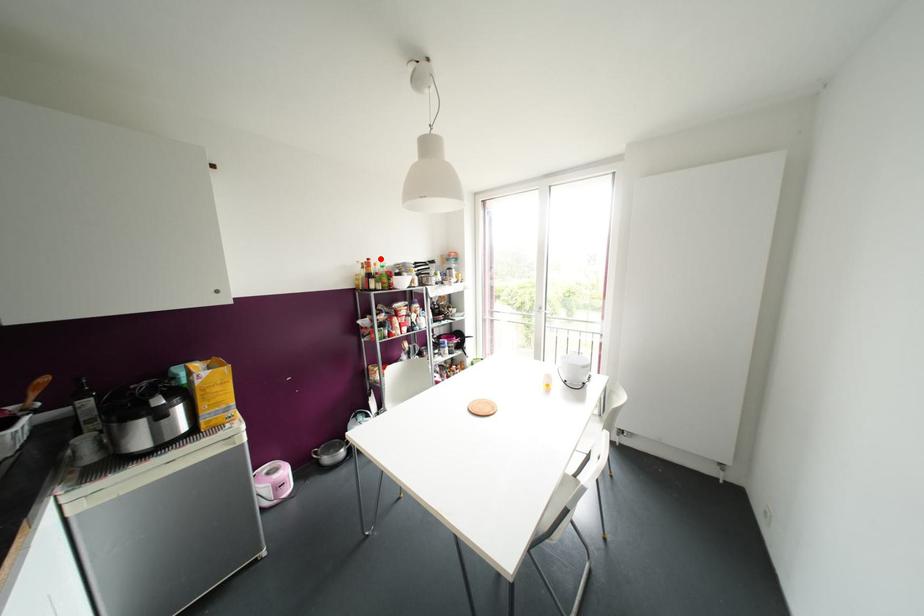
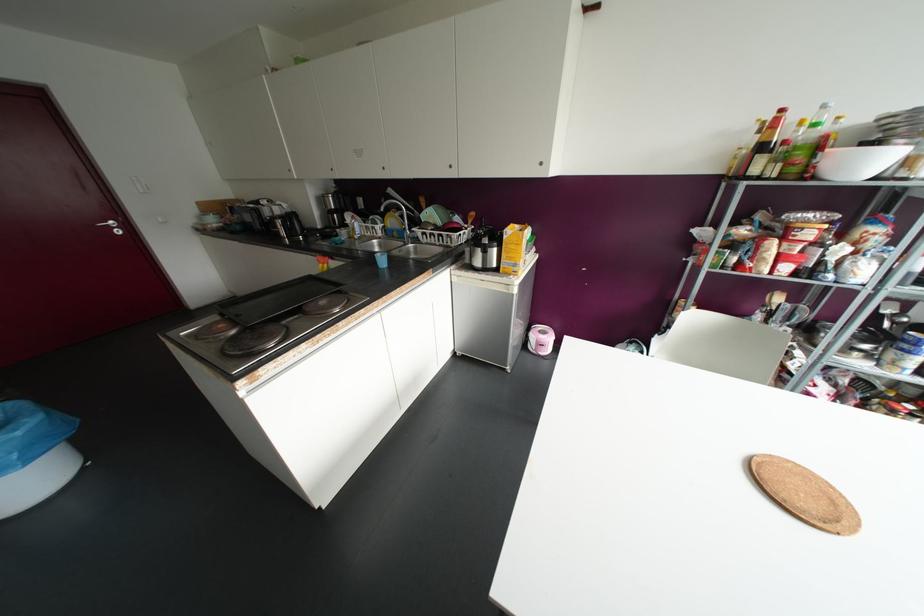
Question: I am providing you with two images of the same scene from different viewpoints. A red point is shown in image1. For the corresponding object point in image2, is it positioned nearer or farther from the camera?

Choices:
 (A) Nearer
 (B) Farther

Answer: (B)